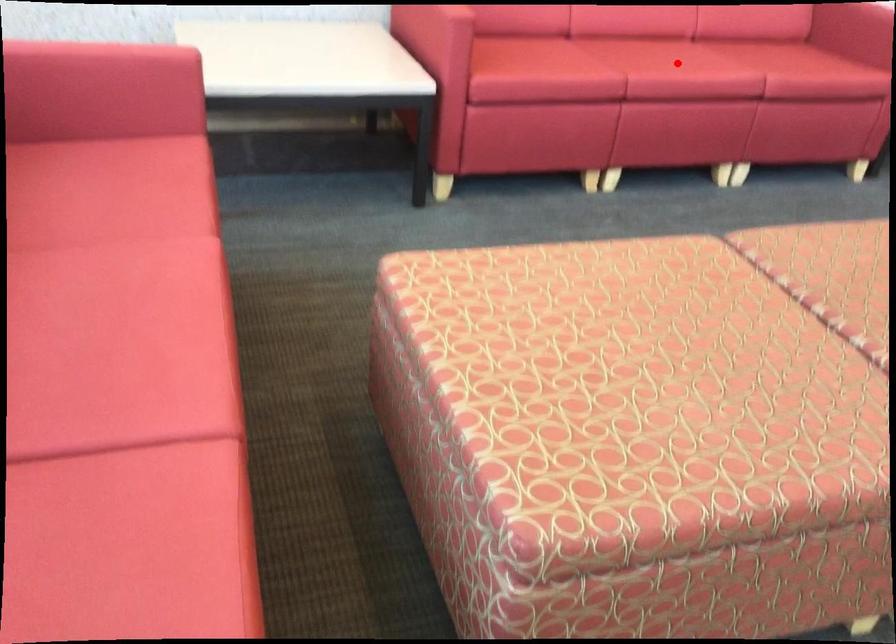
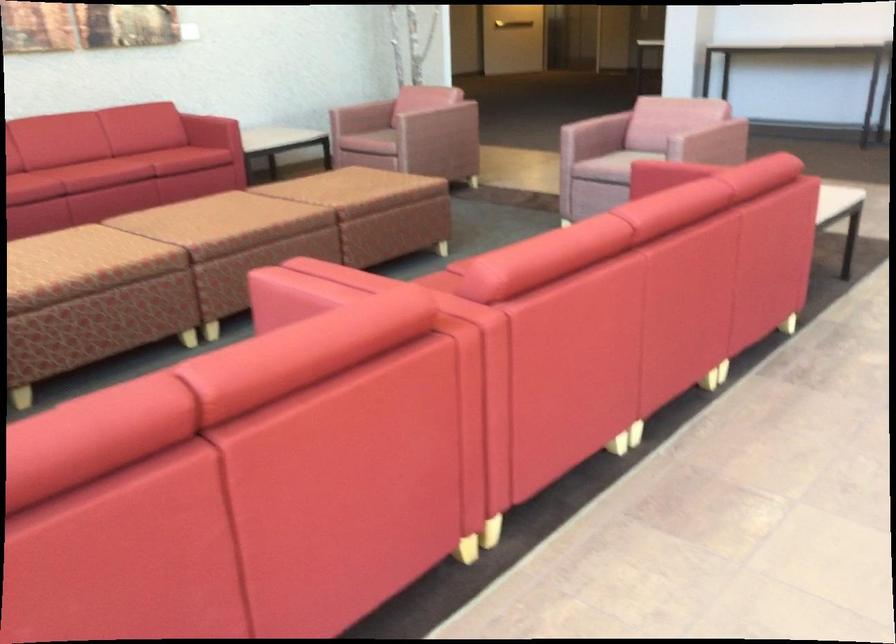
Question: I am providing you with two images of the same scene from different viewpoints. In image1, a red point is highlighted. Considering the same 3D point in image2, which of the following is correct?

Choices:
 (A) It is closer
 (B) It is farther

Answer: (B)